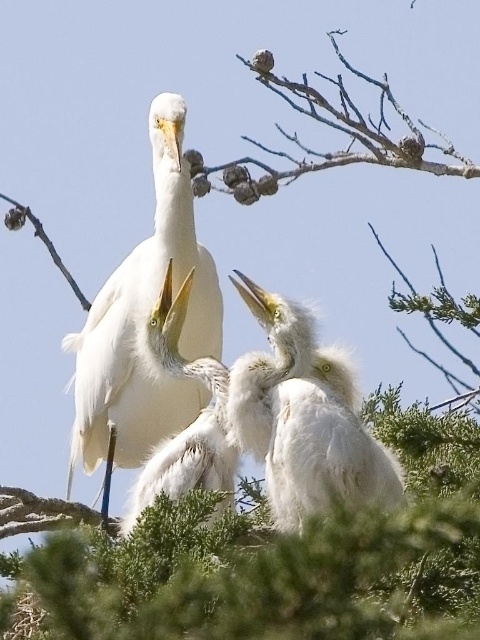
You are a photographer standing in front of a tree with three birds. You notice two points marked on the scene. The first point is at coordinates point (x=120, y=312) and the second point is at point (x=181, y=493). Which of these two points is closer to your camera?

Point (x=120, y=312) is further to the camera than point (x=181, y=493). Therefore, point (x=181, y=493) is closer to the camera.

You are an ornithologist observing the three white birds on the tree branch. You notice the white fluffy bird at center and the white matte bird at center. Which of these two birds is closer to the ground?

The white fluffy bird at center is positioned under the white matte bird at center, so it is closer to the ground.

You are observing the three white birds on the branch. According to the image, which bird is positioned to the right of the other between the white fluffy bird at center and the white matte bird at center?

The white fluffy bird at center is positioned to the right of the white matte bird at center.